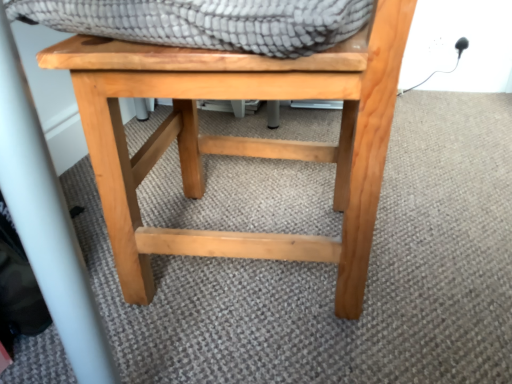
Describe the element at coordinates (239, 140) in the screenshot. I see `natural wood stool at center` at that location.

What is the approximate width of natural wood stool at center?

The width of natural wood stool at center is 22.73 inches.

At what (x,y) coordinates should I click in order to perform the action: click on natural wood stool at center. Please return your answer as a coordinate pair (x, y). The image size is (512, 384). Looking at the image, I should click on (239, 140).

Where is `textured gray blanket at upper center`? textured gray blanket at upper center is located at coordinates (206, 22).

Describe the element at coordinates (206, 22) in the screenshot. The image size is (512, 384). I see `textured gray blanket at upper center` at that location.

You are a GUI agent. You are given a task and a screenshot of the screen. Output one action in this format:
    pyautogui.click(x=<x>, y=<y>)
    Task: Click on the natural wood stool at center
    The width and height of the screenshot is (512, 384).
    Given the screenshot: What is the action you would take?
    pyautogui.click(x=239, y=140)

Visually, is natural wood stool at center positioned to the left or to the right of textured gray blanket at upper center?

Clearly, natural wood stool at center is on the left of textured gray blanket at upper center in the image.

Considering their positions, is natural wood stool at center located in front of or behind textured gray blanket at upper center?

Visually, natural wood stool at center is located behind textured gray blanket at upper center.

Is point (399, 59) positioned behind point (211, 27)?

Yes, it is behind point (211, 27).

From the image's perspective, is natural wood stool at center located above textured gray blanket at upper center?

No, from the image's perspective, natural wood stool at center is not on top of textured gray blanket at upper center.

From a real-world perspective, is natural wood stool at center positioned under textured gray blanket at upper center based on gravity?

Yes, from a real-world perspective, natural wood stool at center is under textured gray blanket at upper center.

Is natural wood stool at center wider or thinner than textured gray blanket at upper center?

Clearly, natural wood stool at center has more width compared to textured gray blanket at upper center.

In terms of height, does natural wood stool at center look taller or shorter compared to textured gray blanket at upper center?

Considering their sizes, natural wood stool at center has more height than textured gray blanket at upper center.

Based on their sizes in the image, would you say natural wood stool at center is bigger or smaller than textured gray blanket at upper center?

natural wood stool at center is bigger than textured gray blanket at upper center.

Is natural wood stool at center outside of textured gray blanket at upper center?

Absolutely, natural wood stool at center is external to textured gray blanket at upper center.

Are natural wood stool at center and textured gray blanket at upper center far apart?

natural wood stool at center is actually quite close to textured gray blanket at upper center.

Is natural wood stool at center looking in the opposite direction of textured gray blanket at upper center?

No, natural wood stool at center is not facing the opposite direction of textured gray blanket at upper center.

The image size is (512, 384). What are the coordinates of `blanket above the natural wood stool at center (from the image's perspective)` in the screenshot? It's located at (206, 22).

Does textured gray blanket at upper center appear on the left side of natural wood stool at center?

No, textured gray blanket at upper center is not to the left of natural wood stool at center.

Between textured gray blanket at upper center and natural wood stool at center, which one is positioned behind?

natural wood stool at center is further away from the camera.

Considering the positions of point (322, 5) and point (243, 78), is point (322, 5) closer or farther from the camera than point (243, 78)?

Point (322, 5) is closer to the camera than point (243, 78).

From the image's perspective, between textured gray blanket at upper center and natural wood stool at center, which one is located above?

textured gray blanket at upper center appears higher in the image.

From a real-world perspective, who is located lower, textured gray blanket at upper center or natural wood stool at center?

natural wood stool at center.

Looking at this image, considering the sizes of objects textured gray blanket at upper center and natural wood stool at center in the image provided, who is wider, textured gray blanket at upper center or natural wood stool at center?

With larger width is natural wood stool at center.

In the scene shown: Does textured gray blanket at upper center have a greater height compared to natural wood stool at center?

No.

Considering the sizes of objects textured gray blanket at upper center and natural wood stool at center in the image provided, who is bigger, textured gray blanket at upper center or natural wood stool at center?

natural wood stool at center.

Would you say textured gray blanket at upper center is inside or outside natural wood stool at center?

textured gray blanket at upper center is inside natural wood stool at center.

Is textured gray blanket at upper center placed right next to natural wood stool at center?

No, textured gray blanket at upper center is not making contact with natural wood stool at center.

Is textured gray blanket at upper center looking in the opposite direction of natural wood stool at center?

Yes, natural wood stool at center is at the back of textured gray blanket at upper center.

How many degrees apart are the facing directions of textured gray blanket at upper center and natural wood stool at center?

There is a 4.78-degree angle between the facing directions of textured gray blanket at upper center and natural wood stool at center.

You are a GUI agent. You are given a task and a screenshot of the screen. Output one action in this format:
    pyautogui.click(x=<x>, y=<y>)
    Task: Click on the stool located on the left of textured gray blanket at upper center
    
    Given the screenshot: What is the action you would take?
    pyautogui.click(x=239, y=140)

Where is `blanket above the natural wood stool at center (from the image's perspective)`? The image size is (512, 384). blanket above the natural wood stool at center (from the image's perspective) is located at coordinates (206, 22).

Where is `stool that appears below the textured gray blanket at upper center (from the image's perspective)`? The width and height of the screenshot is (512, 384). stool that appears below the textured gray blanket at upper center (from the image's perspective) is located at coordinates (239, 140).